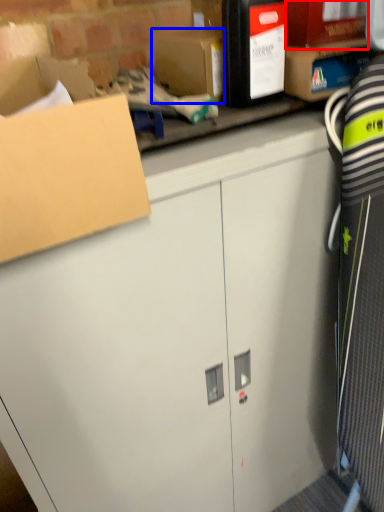
Question: Which object appears closest to the camera in this image, storage box (highlighted by a red box) or storage box (highlighted by a blue box)?

Choices:
 (A) storage box
 (B) storage box

Answer: (A)